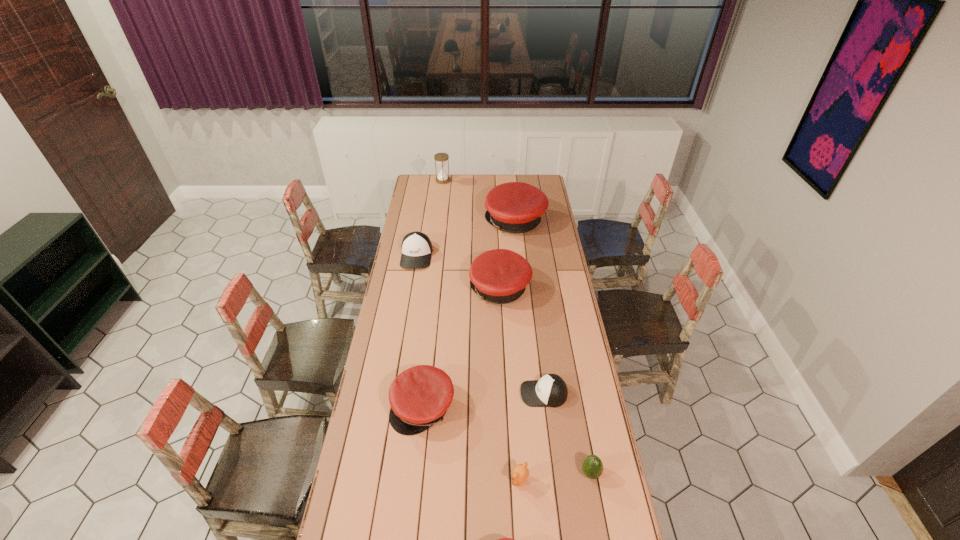
This screenshot has height=540, width=960. What are the coordinates of `teddy bear` in the screenshot? It's located at (520, 473).

Locate an element on the screen. The width and height of the screenshot is (960, 540). avocado is located at coordinates (592, 467).

At what (x,y) coordinates should I click in order to perform the action: click on the right gray cap. Please return your answer as a coordinate pair (x, y). Looking at the image, I should click on (551, 390).

Find the location of a particular element. The width and height of the screenshot is (960, 540). the nearer gray cap is located at coordinates click(551, 390).

Where is `blank space located 0.170m on the front of the hourglass`? blank space located 0.170m on the front of the hourglass is located at coordinates (441, 198).

Identify the location of blank space located at the front of the tallest cap where the visor is located. (455, 222).

Image resolution: width=960 pixels, height=540 pixels. What are the coordinates of `vacant region located 0.340m at the front of the tallest cap where the visor is located` in the screenshot? It's located at (425, 222).

You are a GUI agent. You are given a task and a screenshot of the screen. Output one action in this format:
    pyautogui.click(x=<x>, y=<y>)
    Task: Click on the vacant space located at the front of the tallest cap where the visor is located
    
    Given the screenshot: What is the action you would take?
    pyautogui.click(x=462, y=222)

This screenshot has width=960, height=540. What are the coordinates of `vacant space located 0.080m at the front of the third smallest red cap where the visor is located` in the screenshot? It's located at (453, 289).

In order to click on free space located 0.200m at the front of the third smallest red cap where the visor is located in this screenshot , I will do `click(428, 289)`.